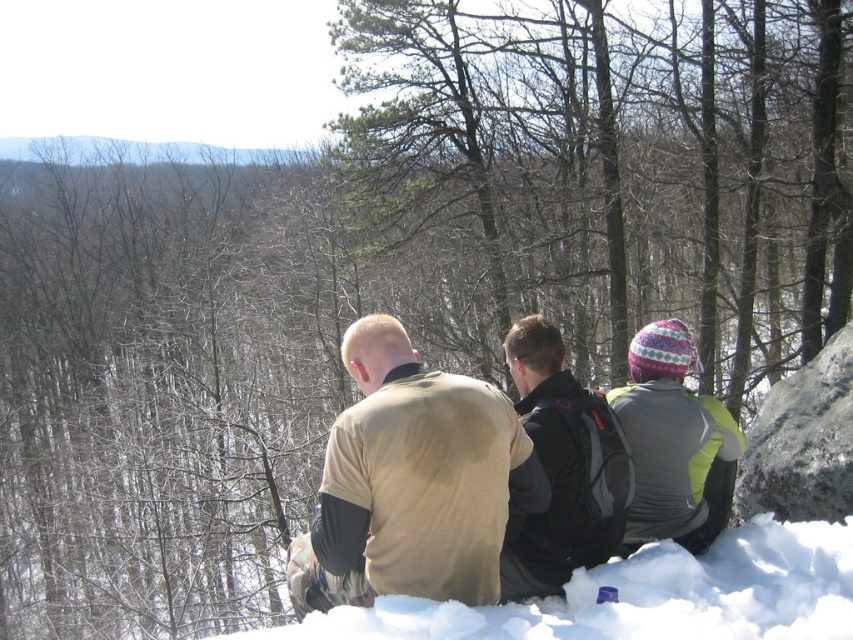
Question: Which object is positioned closest to the smooth bark tree at center?

Choices:
 (A) white fluffy snow at lower center
 (B) black matte jacket at center
 (C) gray rough rock at right

Answer: (C)

Question: Which point is closer to the camera?

Choices:
 (A) white fluffy snow at lower center
 (B) tan fabric jacket at center
 (C) gray rough rock at right
 (D) smooth bark tree at center

Answer: (A)

Question: Is tan fabric jacket at center to the left of black matte jacket at center from the viewer's perspective?

Choices:
 (A) yes
 (B) no

Answer: (A)

Question: Is smooth bark tree at center positioned in front of gray rough rock at right?

Choices:
 (A) no
 (B) yes

Answer: (A)

Question: Is white fluffy snow at lower center further to the viewer compared to black matte jacket at center?

Choices:
 (A) yes
 (B) no

Answer: (B)

Question: Among these points, which one is nearest to the camera?

Choices:
 (A) (480, 72)
 (B) (566, 605)
 (C) (537, 476)
 (D) (844, 330)

Answer: (B)